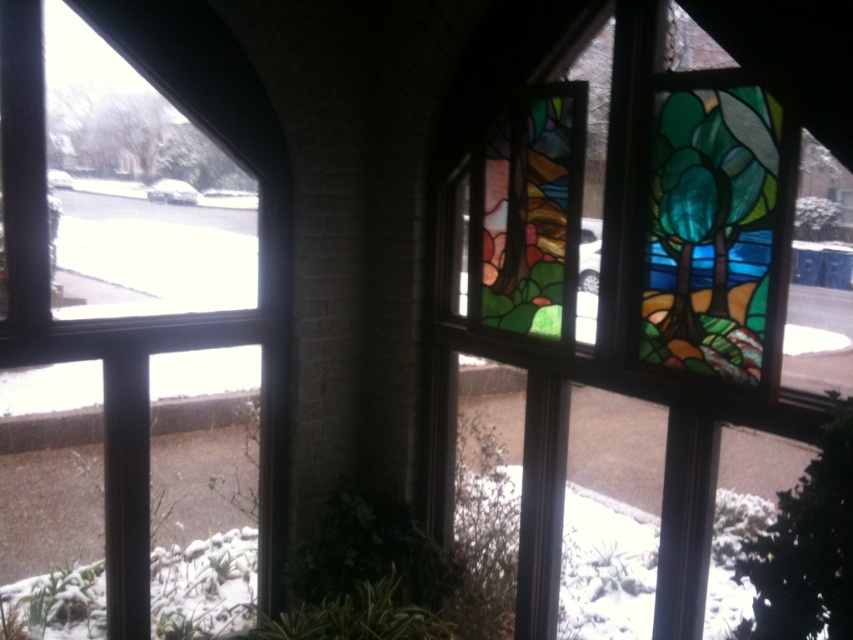
Consider the image. You are an interior designer planning to hang a large rectangular painting that is 1.2 meters tall. You want to place it above a piece of furniture so that the painting is centered between the clear glass window at upper left and the stained glass window at center. Considering their heights, will the painting fit vertically between them without overlapping either window?

The clear glass window at upper left is much taller than the stained glass window at center. Since the painting is 1.2 meters tall, it might not fit vertically between them if the height difference between the two windows creates a gap smaller than the painting. However, the exact placement depends on the actual height measurements of the windows, which are not provided here.

You are an interior designer planning to hang a large painting between the clear glass window at upper left and the stained glass window at center. Based on their positions, where should you place the painting so it is centered between both windows?

The clear glass window at upper left is to the left of the stained glass window at center, so placing the painting between them would require positioning it in the middle of the space between the two windows, aligned horizontally between their centers.

You are an interior designer planning to install a new lighting fixture. You want to place it above the window that takes up more space. Which window should you choose between the clear glass window at upper left and the stained glass window at center?

The stained glass window at center occupies more space than the clear glass window at upper left, so you should place the lighting fixture above the stained glass window at center.